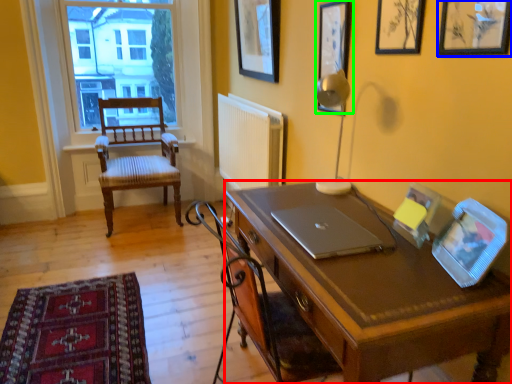
Question: Considering the real-world distances, which object is farthest from desk (highlighted by a red box)? picture frame (highlighted by a blue box) or picture frame (highlighted by a green box)?

Choices:
 (A) picture frame
 (B) picture frame

Answer: (B)